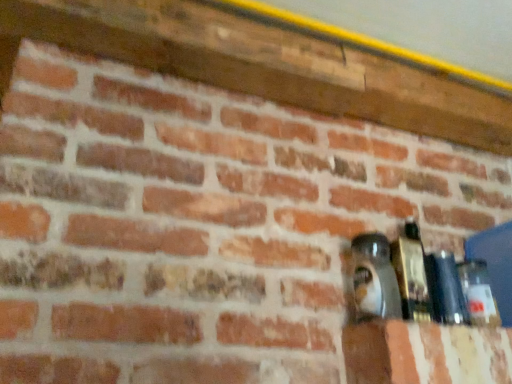
Question: From the image's perspective, is clear glass bottle at right, marked as the fourth bottle in a left-to-right arrangement, on matte black bottle at right, which is the 4th bottle in right-to-left order?

Choices:
 (A) no
 (B) yes

Answer: (A)

Question: Is clear glass bottle at right, marked as the fourth bottle in a left-to-right arrangement, oriented towards matte black bottle at right, which is the 4th bottle in right-to-left order?

Choices:
 (A) no
 (B) yes

Answer: (A)

Question: Is clear glass bottle at right, marked as the fourth bottle in a left-to-right arrangement, smaller than matte black bottle at right, which is the 4th bottle in right-to-left order?

Choices:
 (A) yes
 (B) no

Answer: (A)

Question: Is matte black bottle at right, the first bottle viewed from the left, inside clear glass bottle at right, positioned as the first bottle in right-to-left order?

Choices:
 (A) no
 (B) yes

Answer: (A)

Question: Is clear glass bottle at right, positioned as the first bottle in right-to-left order, placed right next to matte black bottle at right, which is the 4th bottle in right-to-left order?

Choices:
 (A) yes
 (B) no

Answer: (B)

Question: From the image's perspective, is matte black bottle at right, which is the 4th bottle in right-to-left order, above or below clear glass bottle at right, positioned as the first bottle in right-to-left order?

Choices:
 (A) above
 (B) below

Answer: (A)

Question: Is point (352, 256) positioned closer to the camera than point (474, 276)?

Choices:
 (A) farther
 (B) closer

Answer: (B)

Question: Do you think matte black bottle at right, which is the 4th bottle in right-to-left order, is within clear glass bottle at right, positioned as the first bottle in right-to-left order, or outside of it?

Choices:
 (A) inside
 (B) outside

Answer: (B)

Question: Is matte black bottle at right, which is the 4th bottle in right-to-left order, taller or shorter than clear glass bottle at right, marked as the fourth bottle in a left-to-right arrangement?

Choices:
 (A) short
 (B) tall

Answer: (B)

Question: From a real-world perspective, is matte black bottle at right, the 2th bottle in the right-to-left sequence, positioned above or below clear glass bottle at right, positioned as the first bottle in right-to-left order?

Choices:
 (A) above
 (B) below

Answer: (A)

Question: Based on their sizes in the image, would you say matte black bottle at right, placed as the third bottle when sorted from left to right, is bigger or smaller than clear glass bottle at right, positioned as the first bottle in right-to-left order?

Choices:
 (A) small
 (B) big

Answer: (B)

Question: Is matte black bottle at right, placed as the third bottle when sorted from left to right, situated inside clear glass bottle at right, positioned as the first bottle in right-to-left order, or outside?

Choices:
 (A) inside
 (B) outside

Answer: (B)

Question: From the image's perspective, relative to clear glass bottle at right, positioned as the first bottle in right-to-left order, is matte black bottle at right, the 2th bottle in the right-to-left sequence, above or below?

Choices:
 (A) below
 (B) above

Answer: (B)

Question: From the image's perspective, relative to matte black bottle at right, placed as the third bottle when sorted from left to right, is matte glass bottle at right, the third bottle from the right, above or below?

Choices:
 (A) below
 (B) above

Answer: (B)

Question: Is matte glass bottle at right, the third bottle from the right, inside the boundaries of matte black bottle at right, placed as the third bottle when sorted from left to right, or outside?

Choices:
 (A) inside
 (B) outside

Answer: (B)